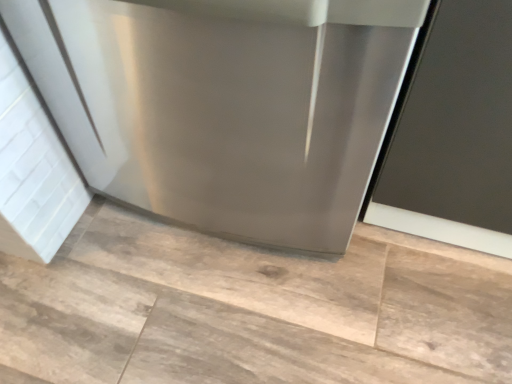
The width and height of the screenshot is (512, 384). Find the location of `stainless steel at center`. stainless steel at center is located at coordinates (224, 104).

What do you see at coordinates (224, 104) in the screenshot?
I see `stainless steel at center` at bounding box center [224, 104].

Where is `stainless steel at center`? stainless steel at center is located at coordinates (224, 104).